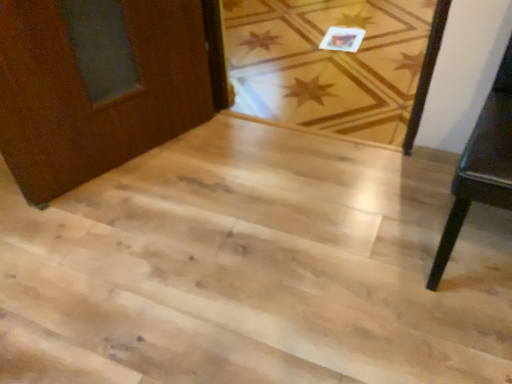
The image size is (512, 384). Describe the element at coordinates (481, 165) in the screenshot. I see `dark wood table at right` at that location.

Identify the location of dark wood table at right. (481, 165).

Does dark wood table at right have a larger size compared to light wood floor at center?

Incorrect, dark wood table at right is not larger than light wood floor at center.

Is light wood floor at center surrounded by dark wood table at right?

No, light wood floor at center is located outside of dark wood table at right.

Could you tell me if dark wood table at right is turned towards light wood floor at center?

No, dark wood table at right does not turn towards light wood floor at center.

Is dark wood table at right next to light wood floor at center?

There is a gap between dark wood table at right and light wood floor at center.

Does light wood floor at center appear on the right side of dark wood table at right?

In fact, light wood floor at center is to the left of dark wood table at right.

Who is taller, light wood floor at center or dark wood table at right?

Standing taller between the two is dark wood table at right.

From a real-world perspective, who is located higher, light wood floor at center or dark wood table at right?

From a 3D spatial view, dark wood table at right is above.

Between light wood floor at center and dark wood table at right, which one has larger width?

Wider between the two is light wood floor at center.

Does point (314, 34) come behind point (57, 260)?

Yes, it is behind point (57, 260).

Which of these two, light wood floor at center or light wood stairs at center, is wider?

Wider between the two is light wood floor at center.

From a real-world perspective, is light wood floor at center below light wood stairs at center?

Yes, from a real-world perspective, light wood floor at center is under light wood stairs at center.

Is light wood stairs at center at the back of light wood floor at center?

light wood floor at center does not have its back to light wood stairs at center.

This screenshot has height=384, width=512. In order to click on furniture in front of the light wood stairs at center in this screenshot , I will do pos(481,165).

Is dark wood table at right in front of or behind light wood stairs at center in the image?

dark wood table at right is positioned closer to the viewer than light wood stairs at center.

From the picture: Is light wood stairs at center completely or partially inside dark wood table at right?

That's incorrect, light wood stairs at center is not inside dark wood table at right.

Is light wood stairs at center with dark wood table at right?

No, light wood stairs at center is not with dark wood table at right.

Is light wood stairs at center located outside dark wood table at right?

light wood stairs at center lies outside dark wood table at right's area.

Consider the image. Is light wood stairs at center at the right side of dark wood table at right?

Incorrect, light wood stairs at center is not on the right side of dark wood table at right.

Considering the relative sizes of light wood stairs at center and dark wood table at right in the image provided, is light wood stairs at center bigger than dark wood table at right?

Incorrect, light wood stairs at center is not larger than dark wood table at right.

Would you say light wood stairs at center is to the left or to the right of light wood floor at center in the picture?

From the image, it's evident that light wood stairs at center is to the left of light wood floor at center.

From the image's perspective, does light wood stairs at center appear lower than light wood floor at center?

Correct, light wood stairs at center appears lower than light wood floor at center in the image.

Locate an element on the screen. This screenshot has width=512, height=384. furniture in front of the light wood floor at center is located at coordinates (481, 165).

Image resolution: width=512 pixels, height=384 pixels. What are the coordinates of `plank below the dark wood table at right (from a real-world perspective)` in the screenshot? It's located at (x=333, y=63).

When comparing their distances from light wood stairs at center, does dark wood table at right or light wood floor at center seem further?

Among the two, light wood floor at center is located further to light wood stairs at center.

Considering their positions, is light wood stairs at center positioned further to light wood floor at center than dark wood table at right?

dark wood table at right.

When comparing their distances from dark wood table at right, does light wood floor at center or light wood stairs at center seem further?

light wood floor at center.

Estimate the real-world distances between objects in this image. Which object is further from light wood stairs at center, light wood floor at center or dark wood table at right?

The object further to light wood stairs at center is light wood floor at center.

Which object lies further to the anchor point light wood floor at center, dark wood table at right or light wood stairs at center?

dark wood table at right is positioned further to the anchor light wood floor at center.

Which object lies further to the anchor point dark wood table at right, light wood stairs at center or light wood floor at center?

light wood floor at center.

Identify the location of stairwell positioned between dark wood table at right and light wood floor at center from near to far. (253, 269).